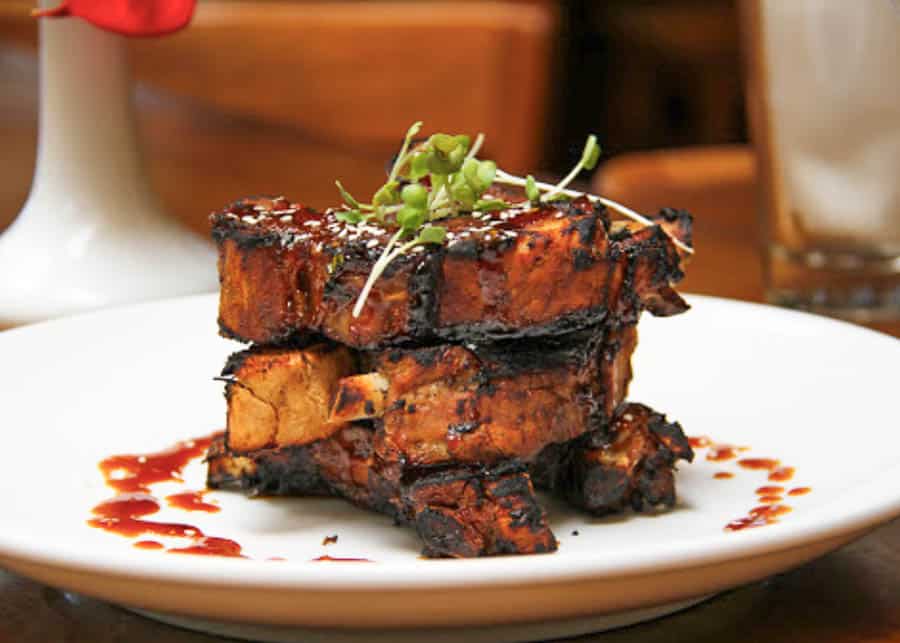
Find the location of a particular element. This screenshot has height=643, width=900. plate is located at coordinates (284, 586).